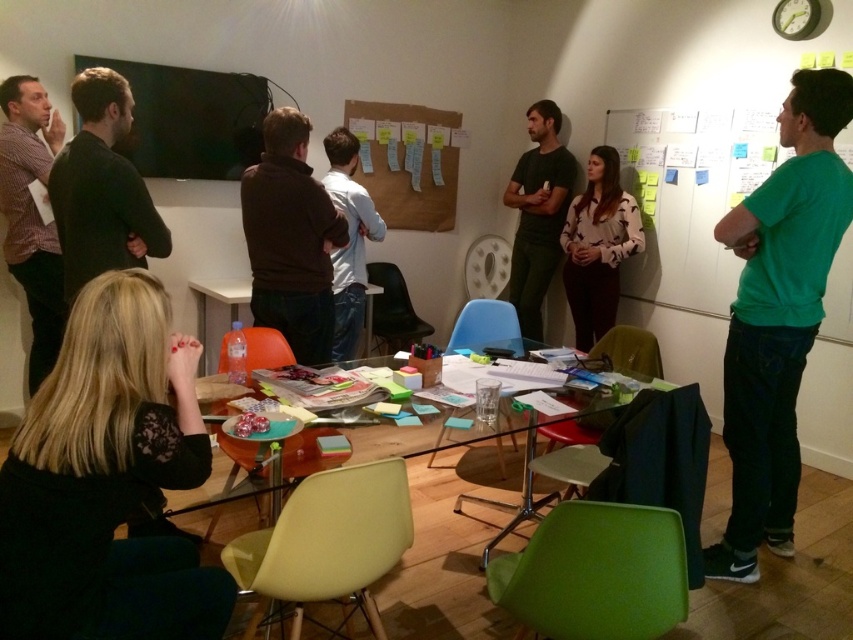
You are a delivery person who needs to place a 2 meter long package between the brown matte sweater at center and the white printed blouse at center. Can you fit the package between them without moving either of the items?

The distance between the brown matte sweater at center and the white printed blouse at center is 1.98 meters. Since the package is 2 meters long, it cannot fit between them without moving either item.

You are a person standing at the entrance of the room. You see two people sitting at the table. One is wearing a brown matte sweater at center and the other is wearing a dark green shirt at center. Which one is sitting closer to the floor?

The brown matte sweater at center is below dark green shirt at center, so the person wearing the brown matte sweater at center is sitting closer to the floor.